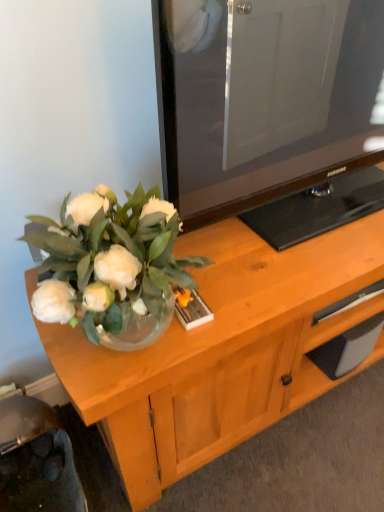
The height and width of the screenshot is (512, 384). What do you see at coordinates (222, 352) in the screenshot? I see `wooden cabinet at center` at bounding box center [222, 352].

The height and width of the screenshot is (512, 384). Identify the location of black rubber drawer at lower right. (329, 344).

Locate an element on the screen. wooden cabinet at center is located at coordinates (222, 352).

Between wooden cabinet at center and black rubber drawer at lower right, which one has smaller size?

With smaller size is black rubber drawer at lower right.

Is point (281, 341) less distant than point (300, 350)?

Yes.

Consider the image. From the image's perspective, which one is positioned higher, wooden cabinet at center or black rubber drawer at lower right?

black rubber drawer at lower right is shown above in the image.

From a real-world perspective, is metallic silver swivel chair at lower left positioned over black rubber drawer at lower right based on gravity?

No, from a real-world perspective, metallic silver swivel chair at lower left is not over black rubber drawer at lower right

Is metallic silver swivel chair at lower left facing towards black rubber drawer at lower right?

No, metallic silver swivel chair at lower left is not turned towards black rubber drawer at lower right.

Looking at this image, between metallic silver swivel chair at lower left and black rubber drawer at lower right, which one has larger size?

Bigger between the two is metallic silver swivel chair at lower left.

In terms of size, does wooden cabinet at center appear bigger or smaller than metallic silver swivel chair at lower left?

In the image, wooden cabinet at center appears to be smaller than metallic silver swivel chair at lower left.

Which point is more distant from viewer, (x=318, y=377) or (x=1, y=481)?

The point (x=318, y=377) is farther from the camera.

Is wooden cabinet at center at the back of black rubber drawer at lower right?

black rubber drawer at lower right is not turned away from wooden cabinet at center.

Can you confirm if black rubber drawer at lower right is positioned to the right of wooden cabinet at center?

Yes, black rubber drawer at lower right is to the right of wooden cabinet at center.

Is black rubber drawer at lower right positioned in front of wooden cabinet at center?

No.

Can you confirm if black rubber drawer at lower right is taller than wooden cabinet at center?

Yes.

Is metallic silver swivel chair at lower left facing away from wooden cabinet at center?

No, metallic silver swivel chair at lower left is not facing away from wooden cabinet at center.

Which object is thinner, metallic silver swivel chair at lower left or wooden cabinet at center?

Thinner between the two is metallic silver swivel chair at lower left.

From the image's perspective, between metallic silver swivel chair at lower left and wooden cabinet at center, which one is located above?

wooden cabinet at center.

Is metallic silver swivel chair at lower left in front of or behind wooden cabinet at center in the image?

Clearly, metallic silver swivel chair at lower left is in front of wooden cabinet at center.

From a real-world perspective, which is physically above, black rubber drawer at lower right or metallic silver swivel chair at lower left?

In real-world perspective, black rubber drawer at lower right is above.

Based on the photo, from the image's perspective, which is below, black rubber drawer at lower right or metallic silver swivel chair at lower left?

metallic silver swivel chair at lower left.

Image resolution: width=384 pixels, height=512 pixels. What are the coordinates of `desk on the left of the black rubber drawer at lower right` in the screenshot? It's located at (222, 352).

This screenshot has width=384, height=512. In order to click on swivel chair located below the black rubber drawer at lower right (from the image's perspective) in this screenshot , I will do coord(35,457).

Which object lies nearer to the anchor point metallic silver swivel chair at lower left, black rubber drawer at lower right or wooden cabinet at center?

Among the two, wooden cabinet at center is located nearer to metallic silver swivel chair at lower left.

When comparing their distances from wooden cabinet at center, does black rubber drawer at lower right or metallic silver swivel chair at lower left seem closer?

black rubber drawer at lower right is closer to wooden cabinet at center.

Which object lies nearer to the anchor point black rubber drawer at lower right, metallic silver swivel chair at lower left or wooden cabinet at center?

The object closer to black rubber drawer at lower right is wooden cabinet at center.

Estimate the real-world distances between objects in this image. Which object is further from wooden cabinet at center, metallic silver swivel chair at lower left or black rubber drawer at lower right?

metallic silver swivel chair at lower left is positioned further to the anchor wooden cabinet at center.

From the image, which object appears to be nearer to metallic silver swivel chair at lower left, wooden cabinet at center or black rubber drawer at lower right?

The object closer to metallic silver swivel chair at lower left is wooden cabinet at center.

Looking at this image, which object lies further to the anchor point black rubber drawer at lower right, wooden cabinet at center or metallic silver swivel chair at lower left?

metallic silver swivel chair at lower left is further to black rubber drawer at lower right.

Find the location of a particular element. This screenshot has width=384, height=512. desk situated between metallic silver swivel chair at lower left and black rubber drawer at lower right from left to right is located at coordinates click(x=222, y=352).